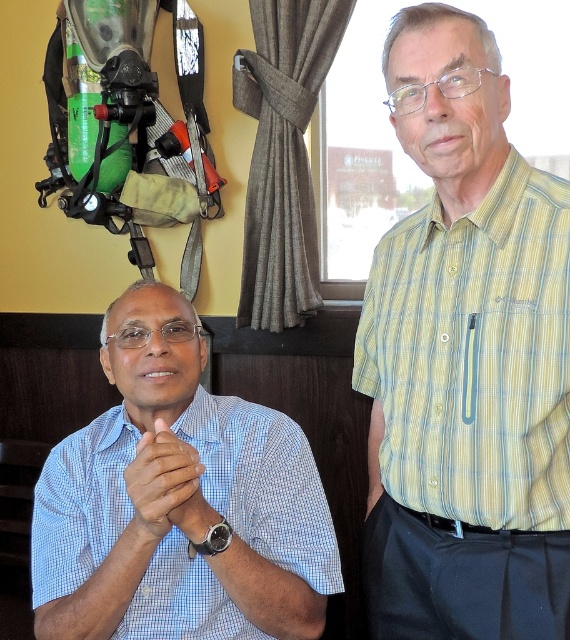
Can you confirm if blue checkered shirt at center is positioned to the right of brown leather watch at center?

Incorrect, blue checkered shirt at center is not on the right side of brown leather watch at center.

From the picture: Which is more to the right, blue checkered shirt at center or brown leather watch at center?

brown leather watch at center is more to the right.

Is point (207, 616) in front of point (128, 472)?

No, (207, 616) is behind (128, 472).

You are a GUI agent. You are given a task and a screenshot of the screen. Output one action in this format:
    pyautogui.click(x=<x>, y=<y>)
    Task: Click on the blue checkered shirt at center
    The height and width of the screenshot is (640, 570).
    Given the screenshot: What is the action you would take?
    pyautogui.click(x=263, y=484)

Based on the photo, is the position of camouflage fabric backpack at upper left less distant than that of brown leather watch at center?

No.

Who is positioned more to the left, camouflage fabric backpack at upper left or brown leather watch at center?

camouflage fabric backpack at upper left is more to the left.

What do you see at coordinates (124, 118) in the screenshot? I see `camouflage fabric backpack at upper left` at bounding box center [124, 118].

Find the location of a particular element. camouflage fabric backpack at upper left is located at coordinates (124, 118).

Consider the image. Is blue checkered shirt at center smaller than camouflage fabric backpack at upper left?

Yes.

The width and height of the screenshot is (570, 640). I want to click on blue checkered shirt at center, so click(x=263, y=484).